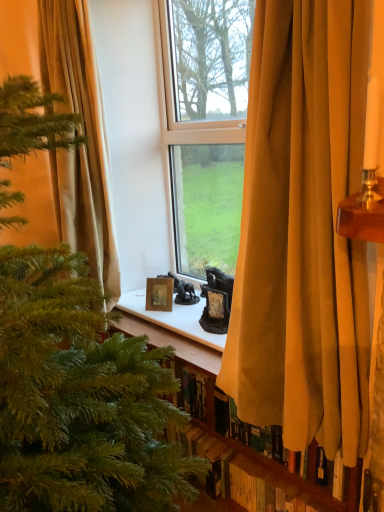
In order to face wooden photo frame at center, should I rotate leftwards or rightwards?

To face it directly, rotate left by 4.251 degrees.

Measure the distance between green matte christmas tree at left and camera.

70.39 centimeters.

The image size is (384, 512). I want to click on velvet gold curtain at center, which is counted as the 2th curtain, starting from the left, so click(x=303, y=230).

Which object is thinner, wooden photo frame at center or green matte christmas tree at left?

wooden photo frame at center.

Between wooden photo frame at center and green matte christmas tree at left, which one has larger size?

Bigger between the two is green matte christmas tree at left.

Considering the positions of points (149, 287) and (5, 378), is point (149, 287) farther from camera compared to point (5, 378)?

Yes, it is.

Where is `christmas tree on the left of the wooden photo frame at center`? The width and height of the screenshot is (384, 512). christmas tree on the left of the wooden photo frame at center is located at coordinates (80, 397).

Considering the relative sizes of green matte christmas tree at left and velvet gold curtain at center, positioned as the second curtain in back-to-front order, in the image provided, is green matte christmas tree at left bigger than velvet gold curtain at center, positioned as the second curtain in back-to-front order,?

Yes.

From a real-world perspective, which is physically below, green matte christmas tree at left or velvet gold curtain at center, which ranks as the 1th curtain in front-to-back order?

From a 3D spatial view, green matte christmas tree at left is below.

Would you say green matte christmas tree at left contains velvet gold curtain at center, which is counted as the 2th curtain, starting from the left?

No, velvet gold curtain at center, which is counted as the 2th curtain, starting from the left, is not surrounded by green matte christmas tree at left.

What's the angular difference between green matte christmas tree at left and velvet gold curtain at center, the first curtain when ordered from right to left,'s facing directions?

There is a 0.00222-degree angle between the facing directions of green matte christmas tree at left and velvet gold curtain at center, the first curtain when ordered from right to left.

From the image's perspective, who appears lower, green matte christmas tree at left or wooden photo frame at center?

green matte christmas tree at left appears lower in the image.

Between green matte christmas tree at left and wooden photo frame at center, which one has more height?

green matte christmas tree at left.

Which of these two, green matte christmas tree at left or wooden photo frame at center, is wider?

green matte christmas tree at left.

Which object is positioned more to the right, green matte christmas tree at left or wooden photo frame at center?

Positioned to the right is wooden photo frame at center.

Which point is more forward, (84, 248) or (173, 342)?

Point (173, 342)

Find the location of a particular element. the 2nd curtain located above the wooden bookshelf at lower center (from a real-world perspective) is located at coordinates (85, 138).

Based on the photo, is beige fabric curtain at left, arranged as the 1th curtain when viewed from the back, looking in the opposite direction of wooden bookshelf at lower center?

No.

Which of these two, beige fabric curtain at left, placed as the 2th curtain when sorted from right to left, or wooden bookshelf at lower center, stands taller?

Standing taller between the two is beige fabric curtain at left, placed as the 2th curtain when sorted from right to left.

From the image's perspective, is wooden bookshelf at lower center located beneath beige fabric curtain at left, arranged as the 1th curtain when viewed from the back?

Yes, from the image's perspective, wooden bookshelf at lower center is beneath beige fabric curtain at left, arranged as the 1th curtain when viewed from the back.

Is wooden bookshelf at lower center bigger or smaller than beige fabric curtain at left, placed as the 2th curtain when sorted from right to left?

In the image, wooden bookshelf at lower center appears to be smaller than beige fabric curtain at left, placed as the 2th curtain when sorted from right to left.

From a real-world perspective, is wooden bookshelf at lower center physically located above or below beige fabric curtain at left, acting as the second curtain starting from the front?

From a real-world perspective, wooden bookshelf at lower center is physically below beige fabric curtain at left, acting as the second curtain starting from the front.

From the picture: Considering the positions of objects wooden bookshelf at lower center and beige fabric curtain at left, placed as the 2th curtain when sorted from right to left, in the image provided, who is in front, wooden bookshelf at lower center or beige fabric curtain at left, placed as the 2th curtain when sorted from right to left,?

Positioned in front is wooden bookshelf at lower center.

Identify the location of christmas tree in front of the velvet gold curtain at center, which ranks as the 1th curtain in front-to-back order. This screenshot has height=512, width=384. (80, 397).

Does velvet gold curtain at center, positioned as the second curtain in back-to-front order, have a larger size compared to green matte christmas tree at left?

Incorrect, velvet gold curtain at center, positioned as the second curtain in back-to-front order, is not larger than green matte christmas tree at left.

Considering the relative positions of velvet gold curtain at center, the first curtain when ordered from right to left, and green matte christmas tree at left in the image provided, is velvet gold curtain at center, the first curtain when ordered from right to left, behind green matte christmas tree at left?

Yes, velvet gold curtain at center, the first curtain when ordered from right to left, is further from the camera.

From a real-world perspective, is green matte christmas tree at left over wooden bookshelf at lower center?

Correct, in the physical world, green matte christmas tree at left is higher than wooden bookshelf at lower center.

Considering the relative sizes of green matte christmas tree at left and wooden bookshelf at lower center in the image provided, is green matte christmas tree at left bigger than wooden bookshelf at lower center?

Correct, green matte christmas tree at left is larger in size than wooden bookshelf at lower center.

Locate an element on the screen. This screenshot has width=384, height=512. christmas tree lying in front of the wooden bookshelf at lower center is located at coordinates click(80, 397).

Which of these two, green matte christmas tree at left or wooden bookshelf at lower center, stands taller?

green matte christmas tree at left is taller.

You are a GUI agent. You are given a task and a screenshot of the screen. Output one action in this format:
    pyautogui.click(x=<x>, y=<y>)
    Task: Click on the christmas tree above the wooden photo frame at center (from a real-world perspective)
    The height and width of the screenshot is (512, 384).
    Given the screenshot: What is the action you would take?
    pyautogui.click(x=80, y=397)

What are the coordinates of `the 1st curtain behind the green matte christmas tree at left` in the screenshot? It's located at (303, 230).

Considering their positions, is green matte christmas tree at left positioned further to wooden bookshelf at lower center than beige fabric curtain at left, placed as the 2th curtain when sorted from right to left?

beige fabric curtain at left, placed as the 2th curtain when sorted from right to left, is positioned further to the anchor wooden bookshelf at lower center.

From the image, which object appears to be nearer to wooden bookshelf at lower center, velvet gold curtain at center, the first curtain when ordered from right to left, or green matte christmas tree at left?

The object closer to wooden bookshelf at lower center is velvet gold curtain at center, the first curtain when ordered from right to left.

When comparing their distances from wooden bookshelf at lower center, does wooden photo frame at center or beige fabric curtain at left, placed as the 2th curtain when sorted from right to left, seem closer?

wooden photo frame at center lies closer to wooden bookshelf at lower center than the other object.

From the image, which object appears to be nearer to wooden bookshelf at lower center, beige fabric curtain at left, arranged as the 1th curtain when viewed from the back, or green matte christmas tree at left?

Based on the image, green matte christmas tree at left appears to be nearer to wooden bookshelf at lower center.

Based on their spatial positions, is wooden photo frame at center or beige fabric curtain at left, placed as the 2th curtain when sorted from right to left, closer to velvet gold curtain at center, which is counted as the 2th curtain, starting from the left?

wooden photo frame at center is positioned closer to the anchor velvet gold curtain at center, which is counted as the 2th curtain, starting from the left.

From the image, which object appears to be farther from wooden bookshelf at lower center, wooden photo frame at center or green matte christmas tree at left?

green matte christmas tree at left is further to wooden bookshelf at lower center.

From the image, which object appears to be farther from green matte christmas tree at left, wooden photo frame at center or beige fabric curtain at left, acting as the second curtain starting from the front?

wooden photo frame at center is further to green matte christmas tree at left.

Looking at the image, which one is located further to green matte christmas tree at left, velvet gold curtain at center, which ranks as the 1th curtain in front-to-back order, or wooden bookshelf at lower center?

The object further to green matte christmas tree at left is wooden bookshelf at lower center.

At what (x,y) coordinates should I click in order to perform the action: click on bookshelf located between velvet gold curtain at center, which ranks as the 1th curtain in front-to-back order, and wooden photo frame at center in the depth direction. Please return your answer as a coordinate pair (x, y). Looking at the image, I should click on (254, 473).

The width and height of the screenshot is (384, 512). In order to click on bookshelf between green matte christmas tree at left and wooden photo frame at center in the front-back direction in this screenshot , I will do `click(254, 473)`.

The image size is (384, 512). I want to click on bookshelf between green matte christmas tree at left and beige fabric curtain at left, acting as the second curtain starting from the front, in the front-back direction, so click(254, 473).

This screenshot has height=512, width=384. I want to click on curtain between green matte christmas tree at left and beige fabric curtain at left, acting as the second curtain starting from the front, from front to back, so click(x=303, y=230).